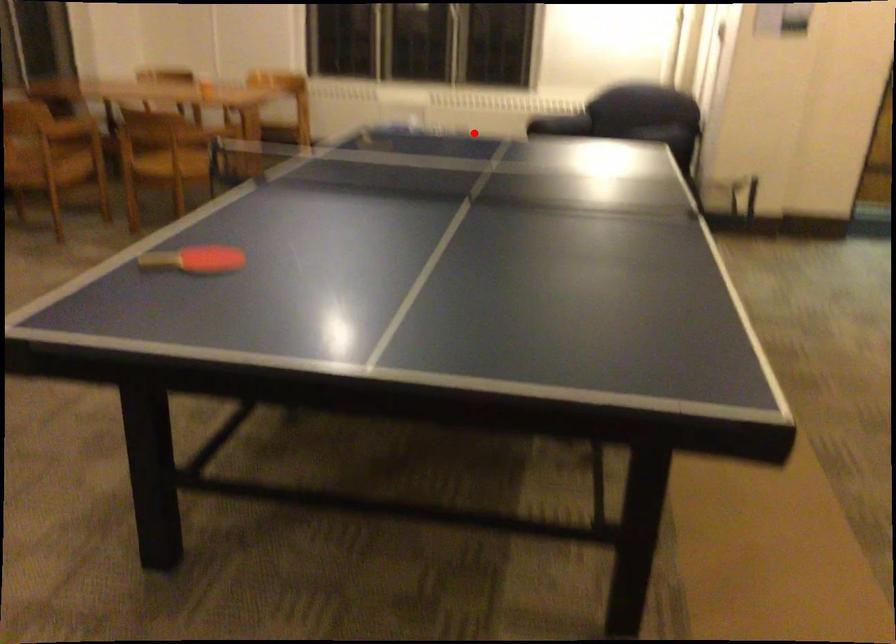
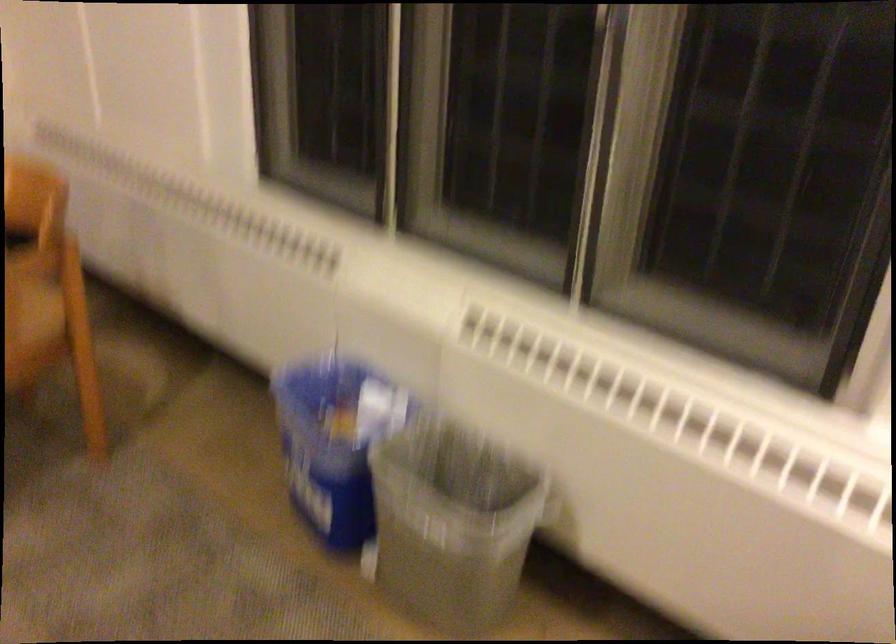
The point at the highlighted location is marked in the first image. Where is the corresponding point in the second image?

(451, 524)